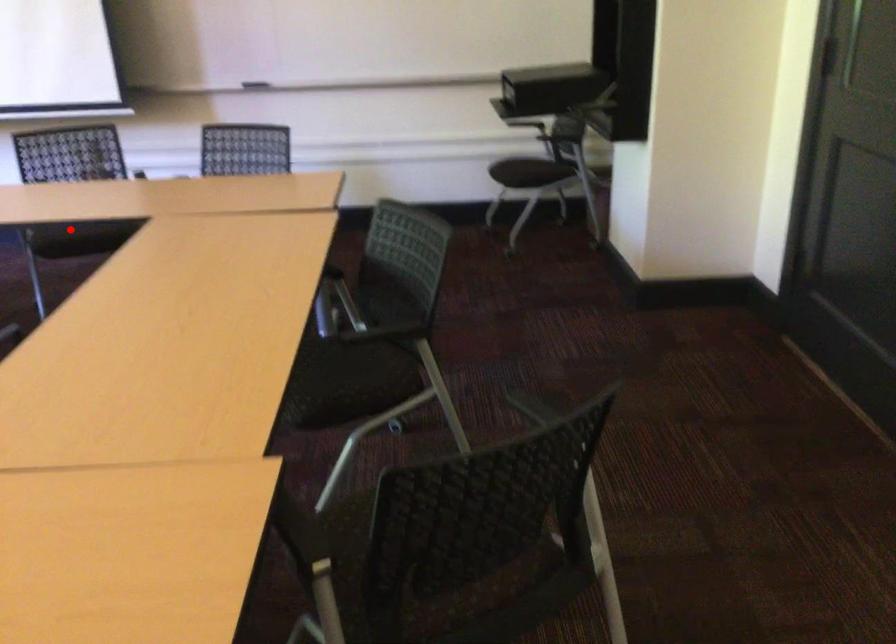
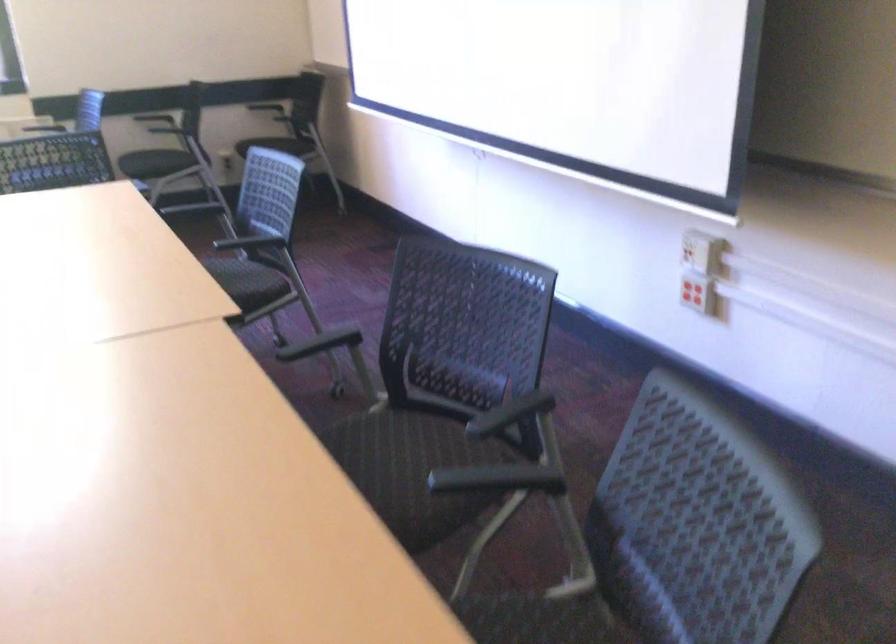
Find the pixel in the second image that matches the highlighted location in the first image.

(389, 453)